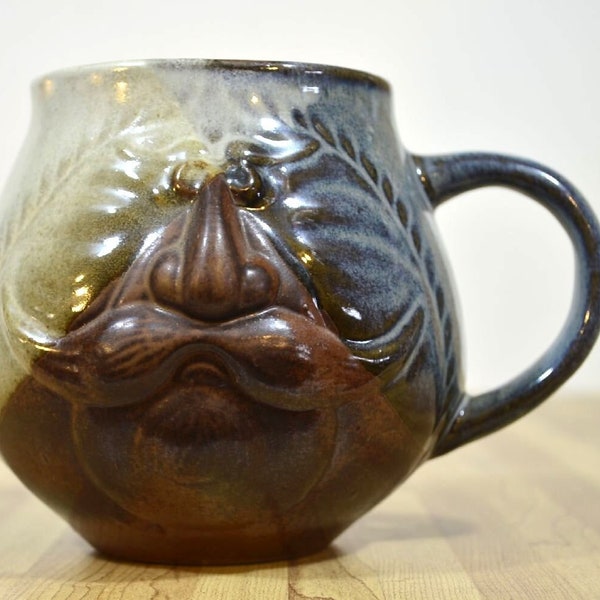
The height and width of the screenshot is (600, 600). I want to click on wall, so click(x=494, y=48).